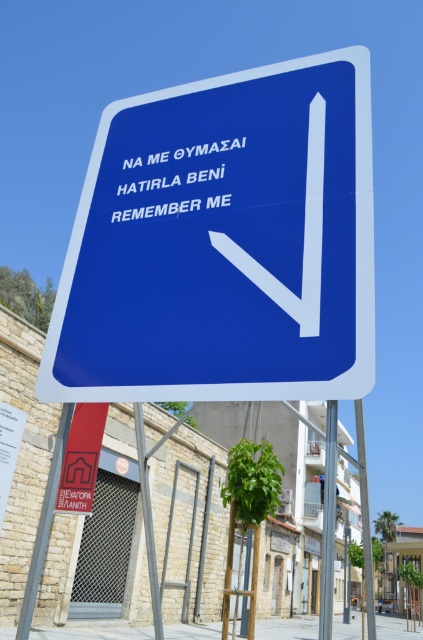
You are a pedestrian standing in front of the large blue road sign. You notice the white plastic arrow at center and the white plastic text at center. Which object appears closer to you?

The white plastic arrow at center is closer to the viewer than the white plastic text at center.